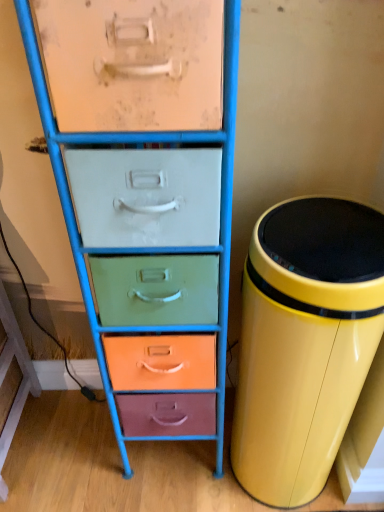
At what (x,y) coordinates should I click in order to perform the action: click on yellow glossy trash can at right. Please return your answer as a coordinate pair (x, y). The height and width of the screenshot is (512, 384). Looking at the image, I should click on (304, 342).

What do you see at coordinates (304, 342) in the screenshot? This screenshot has height=512, width=384. I see `yellow glossy trash can at right` at bounding box center [304, 342].

This screenshot has height=512, width=384. What do you see at coordinates (146, 195) in the screenshot?
I see `metallic drawer unit at center` at bounding box center [146, 195].

The image size is (384, 512). Identify the location of metallic drawer unit at center. (146, 195).

In the scene shown: In order to face metallic drawer unit at center, should I rotate leftwards or rightwards?

You should look left and rotate roughly 3.704 degrees.

Image resolution: width=384 pixels, height=512 pixels. Find the location of `yellow glossy trash can at right`. yellow glossy trash can at right is located at coordinates (304, 342).

Can you confirm if metallic drawer unit at center is positioned to the right of yellow glossy trash can at right?

No, metallic drawer unit at center is not to the right of yellow glossy trash can at right.

Is metallic drawer unit at center in front of or behind yellow glossy trash can at right in the image?

In the image, metallic drawer unit at center appears in front of yellow glossy trash can at right.

Considering the positions of point (127, 415) and point (289, 337), is point (127, 415) closer or farther from the camera than point (289, 337)?

Point (127, 415).

Based on the photo, from the image's perspective, between metallic drawer unit at center and yellow glossy trash can at right, which one is located above?

metallic drawer unit at center is shown above in the image.

In the scene shown: From a real-world perspective, who is located lower, metallic drawer unit at center or yellow glossy trash can at right?

yellow glossy trash can at right is physically lower.

Does metallic drawer unit at center have a greater width compared to yellow glossy trash can at right?

Incorrect, the width of metallic drawer unit at center does not surpass that of yellow glossy trash can at right.

Considering the sizes of objects metallic drawer unit at center and yellow glossy trash can at right in the image provided, who is taller, metallic drawer unit at center or yellow glossy trash can at right?

metallic drawer unit at center is taller.

Considering the sizes of objects metallic drawer unit at center and yellow glossy trash can at right in the image provided, who is bigger, metallic drawer unit at center or yellow glossy trash can at right?

metallic drawer unit at center.

Is metallic drawer unit at center located outside yellow glossy trash can at right?

Yes, metallic drawer unit at center is located beyond the bounds of yellow glossy trash can at right.

Looking at this image, is metallic drawer unit at center not near yellow glossy trash can at right?

That's not correct — metallic drawer unit at center is a little close to yellow glossy trash can at right.

Is metallic drawer unit at center aimed at yellow glossy trash can at right?

No, metallic drawer unit at center is not facing towards yellow glossy trash can at right.

What's the angular difference between metallic drawer unit at center and yellow glossy trash can at right's facing directions?

0.000353 degrees.

Find the location of a particular element. chest of drawers above the yellow glossy trash can at right (from a real-world perspective) is located at coordinates (146, 195).

Between yellow glossy trash can at right and metallic drawer unit at center, which one appears on the left side from the viewer's perspective?

From the viewer's perspective, metallic drawer unit at center appears more on the left side.

In the image, is yellow glossy trash can at right positioned in front of or behind metallic drawer unit at center?

yellow glossy trash can at right is positioned farther from the viewer than metallic drawer unit at center.

Considering the points (259, 301) and (99, 279), which point is behind, point (259, 301) or point (99, 279)?

The point (259, 301) is farther from the camera.

From the image's perspective, between yellow glossy trash can at right and metallic drawer unit at center, which one is located above?

metallic drawer unit at center appears higher in the image.

From a real-world perspective, does yellow glossy trash can at right stand above metallic drawer unit at center?

No, from a real-world perspective, yellow glossy trash can at right is not above metallic drawer unit at center.

Which object is thinner, yellow glossy trash can at right or metallic drawer unit at center?

metallic drawer unit at center is thinner.

Is yellow glossy trash can at right taller or shorter than metallic drawer unit at center?

In the image, yellow glossy trash can at right appears to be shorter than metallic drawer unit at center.

Who is smaller, yellow glossy trash can at right or metallic drawer unit at center?

Result: With smaller size is yellow glossy trash can at right.

Choose the correct answer: Is yellow glossy trash can at right inside metallic drawer unit at center or outside it?

yellow glossy trash can at right cannot be found inside metallic drawer unit at center.

Can you see yellow glossy trash can at right touching metallic drawer unit at center?

yellow glossy trash can at right and metallic drawer unit at center are clearly separated.

Is yellow glossy trash can at right oriented towards metallic drawer unit at center?

No.

Identify the location of waste container below the metallic drawer unit at center (from the image's perspective). (304, 342).

The height and width of the screenshot is (512, 384). What are the coordinates of `the chest of drawers positioned vertically above the yellow glossy trash can at right (from a real-world perspective)` in the screenshot? It's located at (146, 195).

Locate an element on the screen. Image resolution: width=384 pixels, height=512 pixels. waste container on the right side of metallic drawer unit at center is located at coordinates (304, 342).